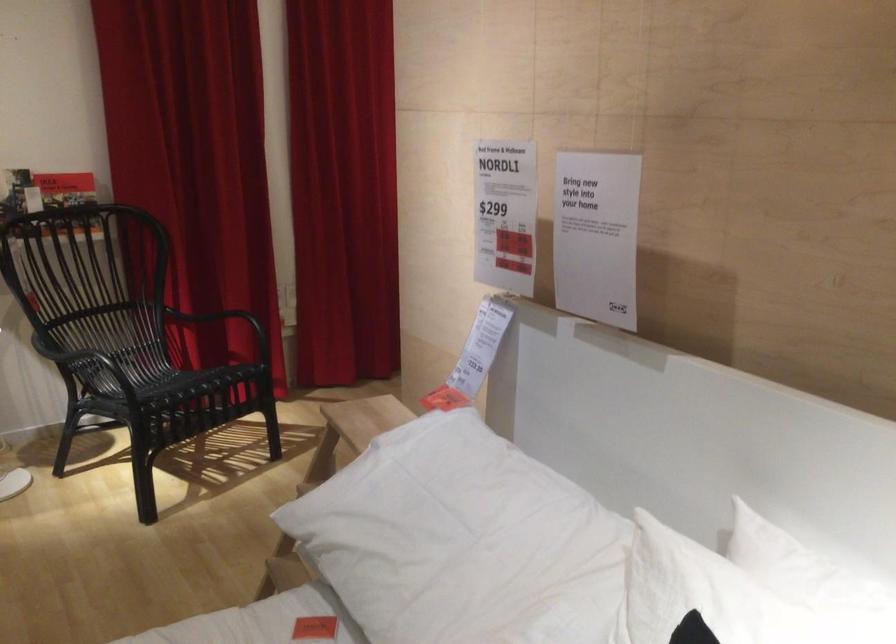
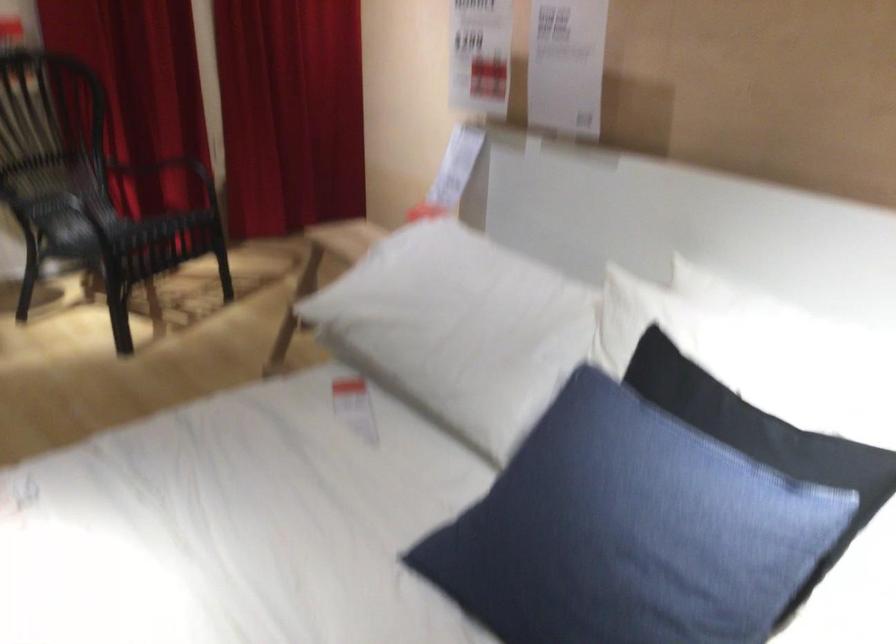
Locate, in the second image, the point that corresponds to the point at 235,321 in the first image.

(176, 169)